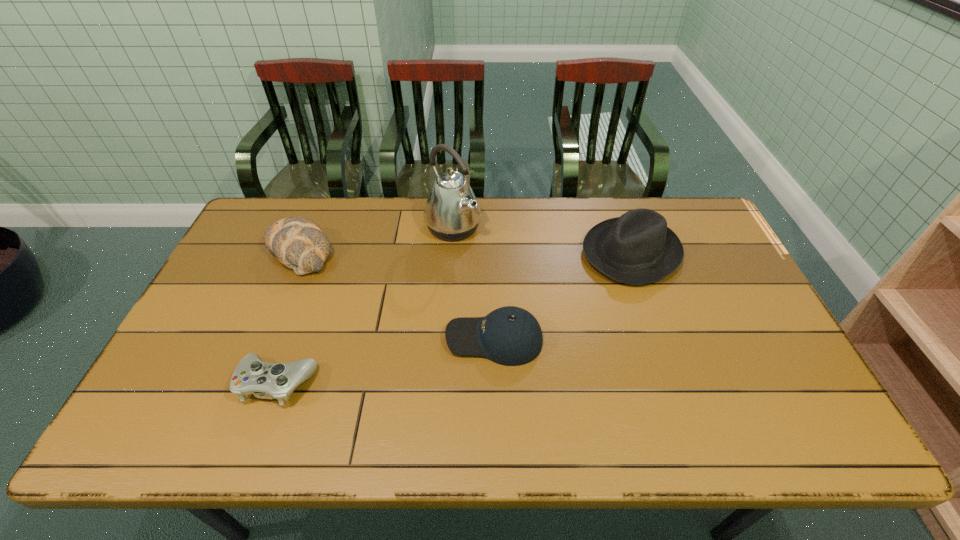
Locate an element on the screen. vacant area that lies between the baseball cap and the bread is located at coordinates (397, 295).

Identify the location of free spot between the tallest object and the control. (365, 305).

Where is `free area in between the baseball cap and the control`? free area in between the baseball cap and the control is located at coordinates (386, 361).

Where is `free point between the baseball cap and the control`? The height and width of the screenshot is (540, 960). free point between the baseball cap and the control is located at coordinates (386, 361).

Select which object is the closest to the bread. Please provide its 2D coordinates. Your answer should be formatted as a tuple, i.e. [(x, y)], where the tuple contains the x and y coordinates of a point satisfying the conditions above.

[(452, 212)]

The image size is (960, 540). Find the location of `object that is the fourth nearest to the control`. object that is the fourth nearest to the control is located at coordinates (637, 248).

Image resolution: width=960 pixels, height=540 pixels. What are the coordinates of `vacant space that satisfies the following two spatial constraints: 1. on the back side of the bread; 2. on the left side of the tallest object` in the screenshot? It's located at (310, 227).